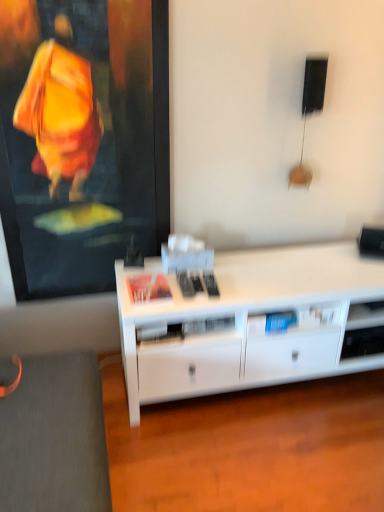
Locate an element on the screen. free space in front of white matte desk at center is located at coordinates (273, 449).